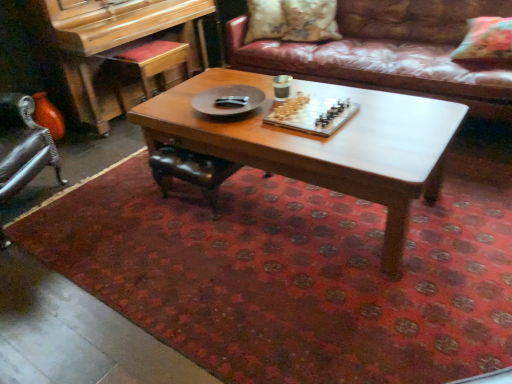
Where is `empty space that is ontop of wooden chessboard at center (from a real-world perspective)`? empty space that is ontop of wooden chessboard at center (from a real-world perspective) is located at coordinates (328, 130).